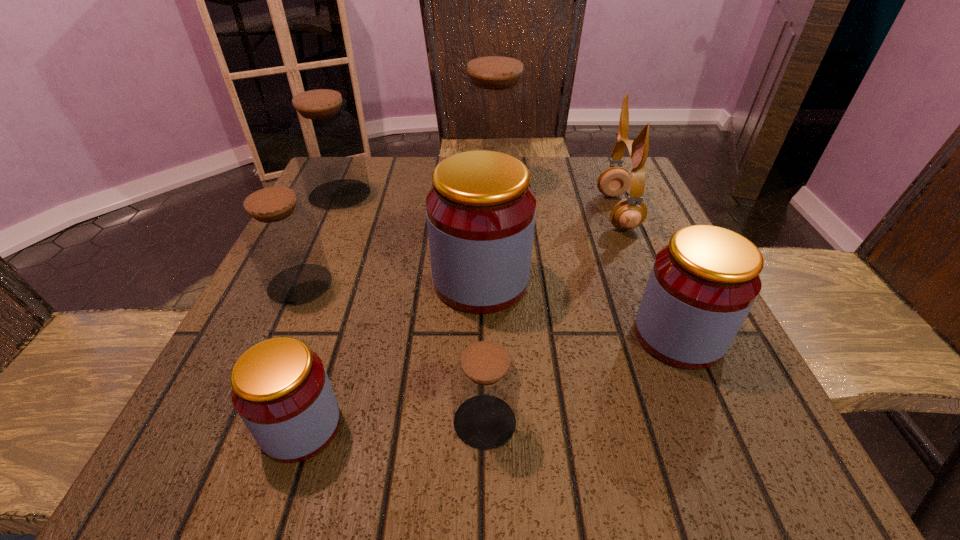
I want to click on earphone located at the far edge, so click(x=629, y=213).

You are a GUI agent. You are given a task and a screenshot of the screen. Output one action in this format:
    pyautogui.click(x=<x>, y=<y>)
    Task: Click on the earphone that is at the right edge
    Image resolution: width=960 pixels, height=540 pixels.
    Given the screenshot: What is the action you would take?
    pyautogui.click(x=629, y=213)

Locate an element on the screen. The image size is (960, 540). jar that is at the right edge is located at coordinates (702, 285).

This screenshot has height=540, width=960. I want to click on object at the far left corner, so click(x=326, y=140).

I want to click on object situated at the near left corner, so click(x=280, y=388).

Identify the location of object that is positioned at the far right corner. The image size is (960, 540). (629, 213).

Locate an element on the screen. blank space at the far edge of the desktop is located at coordinates (557, 182).

In the image, there is a desktop. Identify the location of vacant space at the near edge. The image size is (960, 540). (507, 455).

Locate an element on the screen. The image size is (960, 540). vacant space at the left edge of the desktop is located at coordinates (347, 221).

Locate an element on the screen. vacant space at the right edge of the desktop is located at coordinates (729, 353).